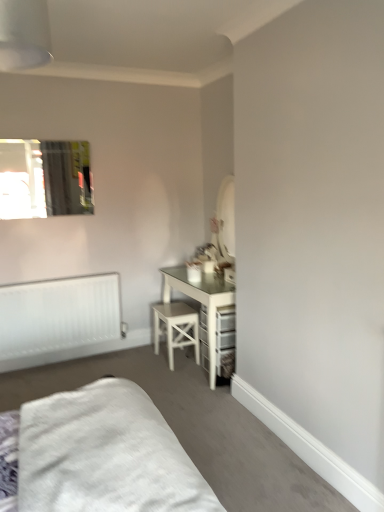
Question: Is white soft bed at lower left not close to white matte radiator at lower left?

Choices:
 (A) yes
 (B) no

Answer: (A)

Question: Does white soft bed at lower left come in front of white matte radiator at lower left?

Choices:
 (A) no
 (B) yes

Answer: (B)

Question: Is white soft bed at lower left wider than white matte radiator at lower left?

Choices:
 (A) yes
 (B) no

Answer: (A)

Question: Considering the relative sizes of white soft bed at lower left and white matte radiator at lower left in the image provided, is white soft bed at lower left thinner than white matte radiator at lower left?

Choices:
 (A) yes
 (B) no

Answer: (B)

Question: Is white matte radiator at lower left located within white soft bed at lower left?

Choices:
 (A) no
 (B) yes

Answer: (A)

Question: From the image's perspective, relative to white matte radiator at lower left, is white wood stool at center above or below?

Choices:
 (A) above
 (B) below

Answer: (B)

Question: Looking at their shapes, would you say white wood stool at center is wider or thinner than white matte radiator at lower left?

Choices:
 (A) thin
 (B) wide

Answer: (B)

Question: From their relative heights in the image, would you say white wood stool at center is taller or shorter than white matte radiator at lower left?

Choices:
 (A) short
 (B) tall

Answer: (A)

Question: Choose the correct answer: Is white wood stool at center inside white matte radiator at lower left or outside it?

Choices:
 (A) outside
 (B) inside

Answer: (A)

Question: Is white matte radiator at lower left situated inside clear glass mirror at upper left or outside?

Choices:
 (A) outside
 (B) inside

Answer: (A)

Question: Relative to clear glass mirror at upper left, is white matte radiator at lower left in front or behind?

Choices:
 (A) behind
 (B) front

Answer: (A)

Question: Based on their sizes in the image, would you say white matte radiator at lower left is bigger or smaller than clear glass mirror at upper left?

Choices:
 (A) small
 (B) big

Answer: (B)

Question: Is white matte radiator at lower left taller or shorter than clear glass mirror at upper left?

Choices:
 (A) short
 (B) tall

Answer: (B)

Question: Is point (18, 182) positioned closer to the camera than point (76, 312)?

Choices:
 (A) closer
 (B) farther

Answer: (A)

Question: Is clear glass mirror at upper left taller or shorter than white matte radiator at lower left?

Choices:
 (A) tall
 (B) short

Answer: (B)